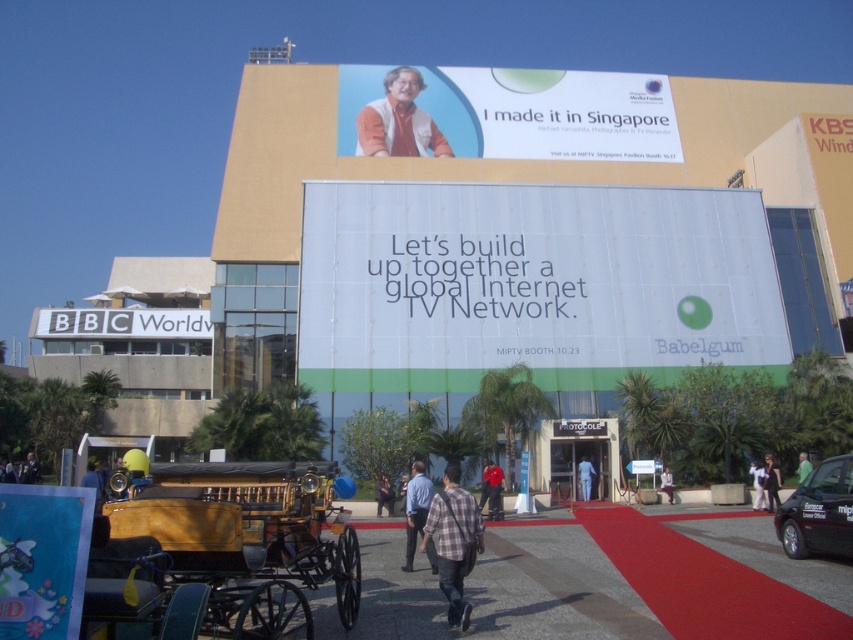
You are organizing a small event at the convention center and need to seat 10 guests. You have access to the white fabric person at lower right and the light brown wooden bench at center. Can both accommodate all guests comfortably?

The light brown wooden bench at center can accommodate more guests than the white fabric person at lower right since it occupies more space. However, together they might not be sufficient to seat all 10 guests comfortably as their combined capacity is unclear. Consider adding more seating options.

Based on the photo, you are standing in front of the convention center and want to read the text on the matte blue poster at lower left. Can you read it clearly from where you are standing?

The matte blue poster at lower left is 5.57 meters away from the viewer, so it is possible to read the text clearly from that distance.